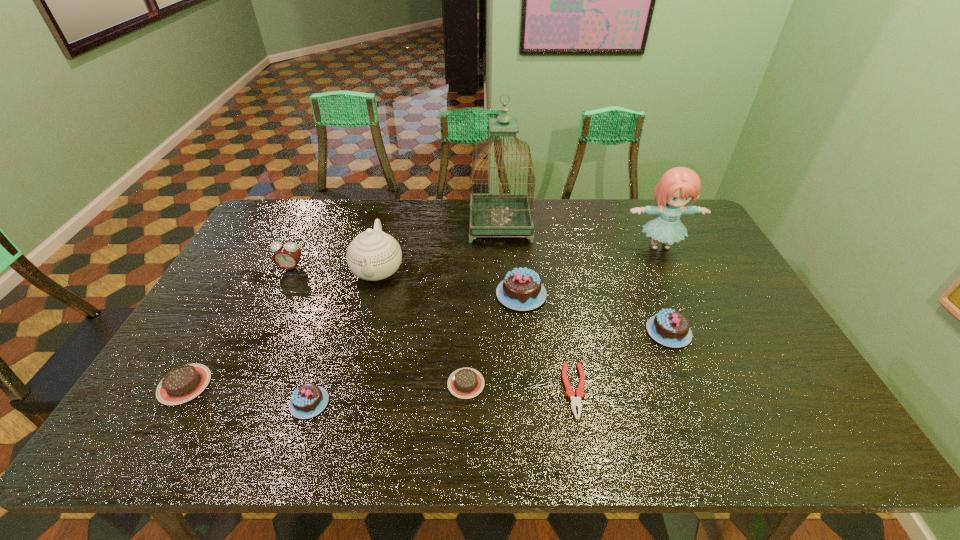
Where is `blank space located 0.070m on the back of the pliers`? blank space located 0.070m on the back of the pliers is located at coordinates (566, 342).

Locate an element on the screen. This screenshot has height=540, width=960. birdcage that is at the far edge is located at coordinates (490, 214).

Locate an element on the screen. Image resolution: width=960 pixels, height=540 pixels. doll that is at the far edge is located at coordinates (677, 186).

This screenshot has width=960, height=540. I want to click on chocolate cake situated at the near edge, so click(x=308, y=400).

Where is `pliers at the near edge`? The image size is (960, 540). pliers at the near edge is located at coordinates (570, 393).

I want to click on alarm clock located in the left edge section of the desktop, so click(x=286, y=256).

This screenshot has width=960, height=540. What are the coordinates of `chocolate cake present at the left edge` in the screenshot? It's located at (181, 384).

Locate an element on the screen. This screenshot has height=540, width=960. object situated at the right edge is located at coordinates (677, 186).

In order to click on object positioned at the far right corner in this screenshot , I will do `click(677, 186)`.

Identify the location of vacant point at the far edge. This screenshot has width=960, height=540. (411, 234).